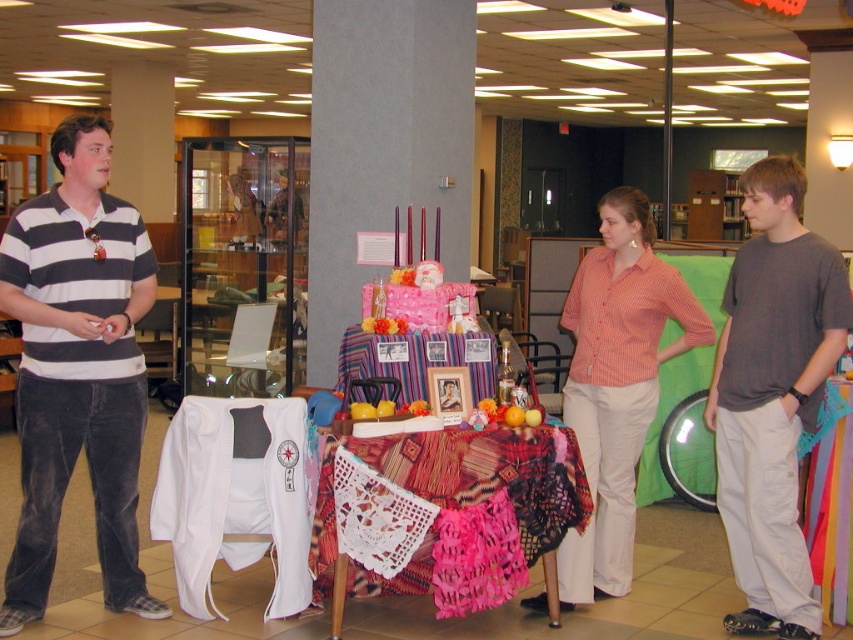
Question: Considering the real-world distances, which object is closest to the orange checkered shirt at center?

Choices:
 (A) textured woven cloth at center
 (B) knitted fabric tablecloth at center
 (C) striped fabric tablecloth at center

Answer: (A)

Question: Does striped polo shirt at left have a larger size compared to gray cotton t-shirt at right?

Choices:
 (A) yes
 (B) no

Answer: (A)

Question: Among these points, which one is farthest from the camera?

Choices:
 (A) (817, 632)
 (B) (570, 332)

Answer: (B)

Question: From the image, what is the correct spatial relationship of orange checkered shirt at center in relation to textured woven cloth at center?

Choices:
 (A) left
 (B) right

Answer: (B)

Question: Among these objects, which one is farthest from the camera?

Choices:
 (A) striped polo shirt at left
 (B) striped fabric tablecloth at center
 (C) orange checkered shirt at center
 (D) gray cotton t-shirt at right

Answer: (B)

Question: Observing the image, what is the correct spatial positioning of gray cotton t-shirt at right in reference to striped fabric tablecloth at center?

Choices:
 (A) below
 (B) above

Answer: (A)